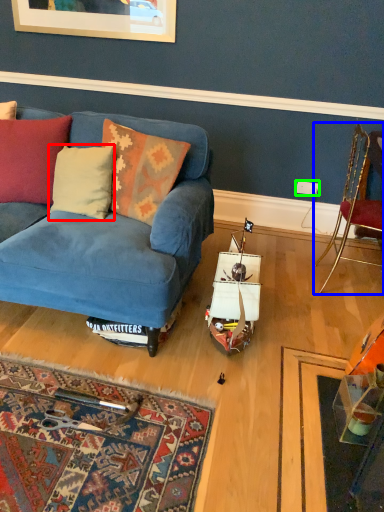
Question: Estimate the real-world distances between objects in this image. Which object is farther from pillow (highlighted by a red box), chair (highlighted by a blue box) or power outlet (highlighted by a green box)?

Choices:
 (A) chair
 (B) power outlet

Answer: (B)